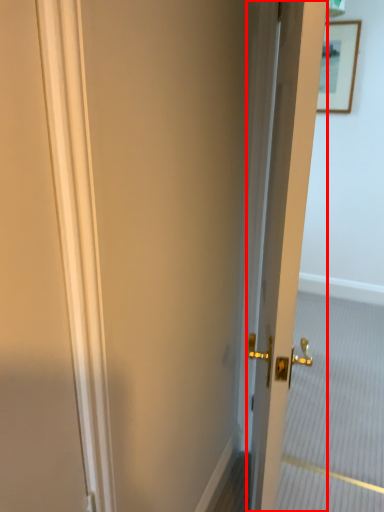
Question: From the image's perspective, what is the correct spatial positioning of door (annotated by the red box) in reference to picture frame?

Choices:
 (A) above
 (B) below

Answer: (B)